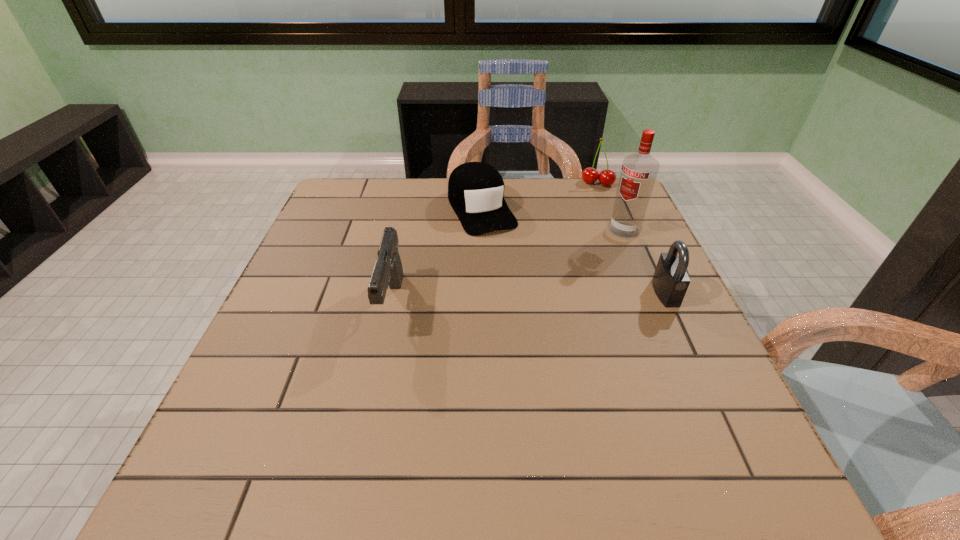
The height and width of the screenshot is (540, 960). I want to click on the second closest object to the pistol, so click(639, 171).

You are a GUI agent. You are given a task and a screenshot of the screen. Output one action in this format:
    pyautogui.click(x=<x>, y=<y>)
    Task: Click on the free spot that satisfies the following two spatial constraints: 1. on the back side of the cap; 2. on the right side of the cherry
    The image size is (960, 540).
    Given the screenshot: What is the action you would take?
    pyautogui.click(x=482, y=184)